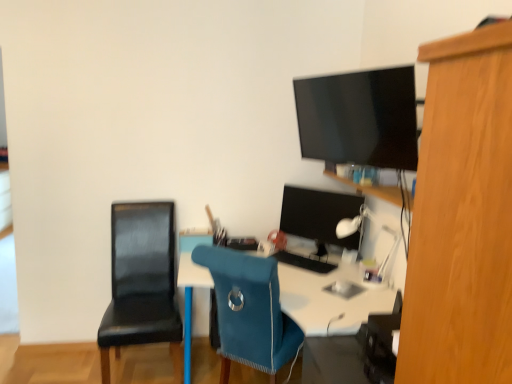
At what (x,y) coordinates should I click in order to perform the action: click on vacant space underneath black matte keyboard at center (from a real-world perspective). Please return your answer as a coordinate pair (x, y). Looking at the image, I should click on (304, 264).